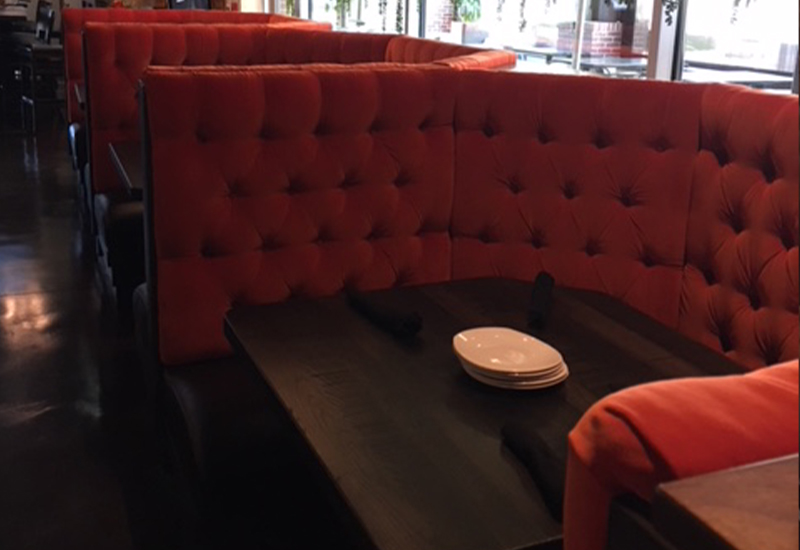
Find the location of a particular element. The image size is (800, 550). cubby seating is located at coordinates (312, 314), (126, 134), (78, 53).